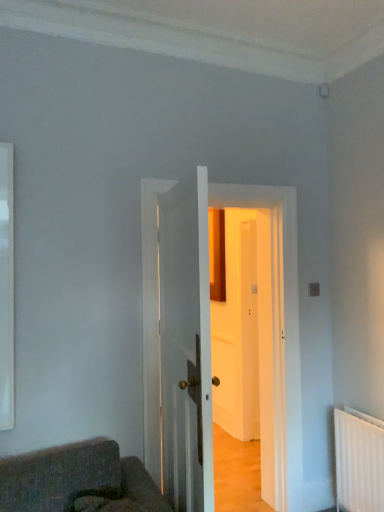
Image resolution: width=384 pixels, height=512 pixels. In order to click on white glossy window at left in this screenshot , I will do `click(6, 288)`.

The height and width of the screenshot is (512, 384). Find the location of `white wooden door at center, the 2th door from the front`. white wooden door at center, the 2th door from the front is located at coordinates pos(210,339).

Locate an element on the screen. Image resolution: width=384 pixels, height=512 pixels. white glossy door at center, the first door when ordered from front to back is located at coordinates (186, 345).

Is white glossy window at left closer to camera compared to white wooden door at center, placed as the first door when sorted from back to front?

Yes, it is in front of white wooden door at center, placed as the first door when sorted from back to front.

Is white glossy window at left smaller than white wooden door at center, the 2th door from the front?

Indeed, white glossy window at left has a smaller size compared to white wooden door at center, the 2th door from the front.

Is white glossy window at left facing away from white wooden door at center, the 2th door from the front?

No.

Which is correct: white glossy window at left is inside white wooden door at center, placed as the first door when sorted from back to front, or outside of it?

white glossy window at left lies outside white wooden door at center, placed as the first door when sorted from back to front.

Who is bigger, white glossy window at left or white glossy door at center, the 2th door in the back-to-front sequence?

With larger size is white glossy door at center, the 2th door in the back-to-front sequence.

Which of these two, white glossy window at left or white glossy door at center, the 2th door in the back-to-front sequence, stands shorter?

Answer: white glossy window at left is shorter.

From a real-world perspective, is white glossy window at left physically below white glossy door at center, the 2th door in the back-to-front sequence?

Actually, white glossy window at left is physically above white glossy door at center, the 2th door in the back-to-front sequence, in the real world.

Is white glossy window at left wider than white glossy door at center, the first door when ordered from front to back?

In fact, white glossy window at left might be narrower than white glossy door at center, the first door when ordered from front to back.

Is point (263, 326) closer to camera compared to point (12, 359)?

No, (263, 326) is further to viewer.

Looking at this image, is white wooden door at center, the 2th door from the front, shorter than white glossy window at left?

No, white wooden door at center, the 2th door from the front, is not shorter than white glossy window at left.

In terms of width, does white wooden door at center, the 2th door from the front, look wider or thinner when compared to white glossy window at left?

Clearly, white wooden door at center, the 2th door from the front, has more width compared to white glossy window at left.

Is white wooden door at center, the 2th door from the front, turned away from white glossy window at left?

No, white wooden door at center, the 2th door from the front, is not facing the opposite direction of white glossy window at left.

From the image's perspective, is white glossy door at center, the first door when ordered from front to back, under white wooden door at center, placed as the first door when sorted from back to front?

No, from the image's perspective, white glossy door at center, the first door when ordered from front to back, is not beneath white wooden door at center, placed as the first door when sorted from back to front.

Between white glossy door at center, the first door when ordered from front to back, and white wooden door at center, placed as the first door when sorted from back to front, which one has smaller width?

white glossy door at center, the first door when ordered from front to back.

Looking at this image, are white glossy door at center, the 2th door in the back-to-front sequence, and white wooden door at center, placed as the first door when sorted from back to front, making contact?

Yes, white glossy door at center, the 2th door in the back-to-front sequence, is in contact with white wooden door at center, placed as the first door when sorted from back to front.

Where is `door above the white wooden door at center, the 2th door from the front (from the image's perspective)`? The image size is (384, 512). door above the white wooden door at center, the 2th door from the front (from the image's perspective) is located at coordinates (186, 345).

From the picture: From a real-world perspective, relative to white glossy door at center, the 2th door in the back-to-front sequence, is white wooden door at center, the 2th door from the front, vertically above or below?

white wooden door at center, the 2th door from the front, is situated lower than white glossy door at center, the 2th door in the back-to-front sequence, in the real world.

Between white wooden door at center, placed as the first door when sorted from back to front, and white glossy door at center, the first door when ordered from front to back, which one has less height?

With less height is white glossy door at center, the first door when ordered from front to back.

Between white wooden door at center, the 2th door from the front, and white glossy door at center, the first door when ordered from front to back, which one appears on the right side from the viewer's perspective?

white wooden door at center, the 2th door from the front, is more to the right.

Between white wooden door at center, placed as the first door when sorted from back to front, and white glossy door at center, the 2th door in the back-to-front sequence, which one has larger size?

white wooden door at center, placed as the first door when sorted from back to front.

Does white glossy door at center, the 2th door in the back-to-front sequence, have a lesser height compared to white glossy window at left?

Answer: No, white glossy door at center, the 2th door in the back-to-front sequence, is not shorter than white glossy window at left.

Considering the relative sizes of white glossy door at center, the first door when ordered from front to back, and white glossy window at left in the image provided, is white glossy door at center, the first door when ordered from front to back, thinner than white glossy window at left?

In fact, white glossy door at center, the first door when ordered from front to back, might be wider than white glossy window at left.

Based on their sizes in the image, would you say white glossy door at center, the first door when ordered from front to back, is bigger or smaller than white glossy window at left?

white glossy door at center, the first door when ordered from front to back, is bigger than white glossy window at left.

Considering the positions of objects white glossy door at center, the first door when ordered from front to back, and white glossy window at left in the image provided, who is more to the right, white glossy door at center, the first door when ordered from front to back, or white glossy window at left?

white glossy door at center, the first door when ordered from front to back, is more to the right.

Find the location of `window on the left side of white wooden door at center, the 2th door from the front`. window on the left side of white wooden door at center, the 2th door from the front is located at coordinates (6, 288).

The image size is (384, 512). In order to click on window behind the white glossy door at center, the first door when ordered from front to back in this screenshot , I will do `click(6, 288)`.

From the image, which object appears to be farther from white glossy window at left, white glossy door at center, the 2th door in the back-to-front sequence, or white wooden door at center, the 2th door from the front?

white glossy door at center, the 2th door in the back-to-front sequence, is further to white glossy window at left.

Considering their positions, is white wooden door at center, the 2th door from the front, positioned closer to white glossy door at center, the 2th door in the back-to-front sequence, than white glossy window at left?

Based on the image, white wooden door at center, the 2th door from the front, appears to be nearer to white glossy door at center, the 2th door in the back-to-front sequence.

Looking at the image, which one is located closer to white wooden door at center, placed as the first door when sorted from back to front, white glossy door at center, the 2th door in the back-to-front sequence, or white glossy window at left?

Based on the image, white glossy door at center, the 2th door in the back-to-front sequence, appears to be nearer to white wooden door at center, placed as the first door when sorted from back to front.

Which object lies nearer to the anchor point white glossy window at left, white wooden door at center, the 2th door from the front, or white glossy door at center, the 2th door in the back-to-front sequence?

Based on the image, white wooden door at center, the 2th door from the front, appears to be nearer to white glossy window at left.

When comparing their distances from white glossy door at center, the 2th door in the back-to-front sequence, does white glossy window at left or white wooden door at center, the 2th door from the front, seem further?

The object further to white glossy door at center, the 2th door in the back-to-front sequence, is white glossy window at left.

Which object lies further to the anchor point white wooden door at center, the 2th door from the front, white glossy window at left or white glossy door at center, the first door when ordered from front to back?

white glossy window at left lies further to white wooden door at center, the 2th door from the front, than the other object.

I want to click on door located between white glossy window at left and white wooden door at center, placed as the first door when sorted from back to front, in the left-right direction, so click(x=186, y=345).